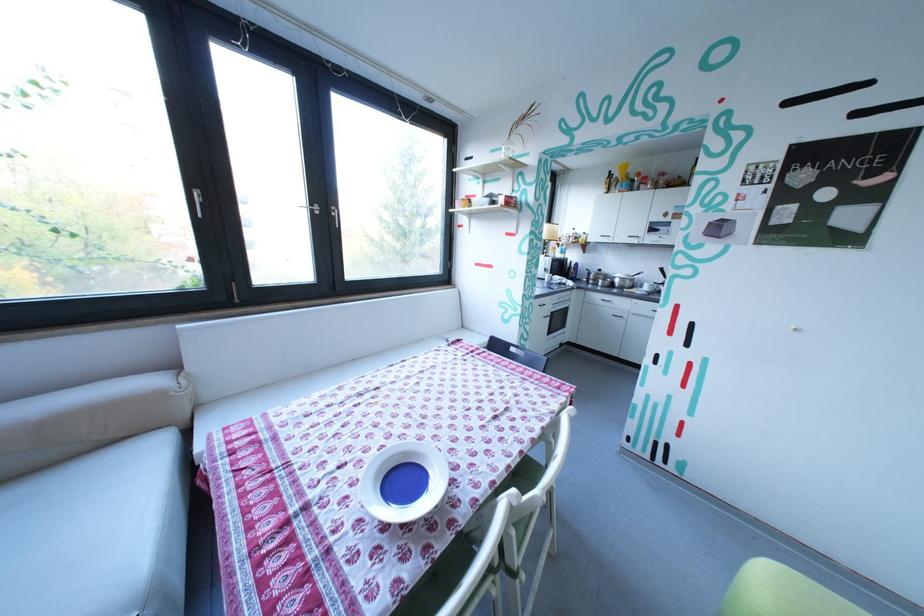
Identify the location of pot lid handle. [624, 280].